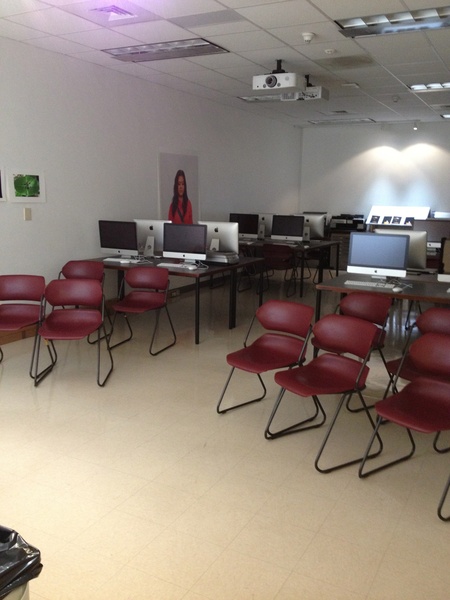
You are a GUI agent. You are given a task and a screenshot of the screen. Output one action in this format:
    pyautogui.click(x=<x>, y=<y>)
    Task: Click on the trash can
    Image resolution: width=450 pixels, height=600 pixels.
    Given the screenshot: What is the action you would take?
    pyautogui.click(x=13, y=598)